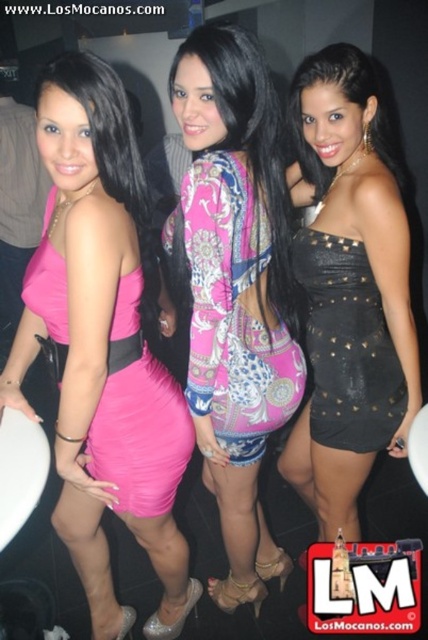
How distant is black studded dress at center from matte pink dress at left?

black studded dress at center and matte pink dress at left are 21.45 inches apart.

Does black studded dress at center appear over matte pink dress at left?

Yes.

This screenshot has width=428, height=640. Identify the location of black studded dress at center. (348, 291).

Image resolution: width=428 pixels, height=640 pixels. What are the coordinates of `black studded dress at center` in the screenshot? It's located at (348, 291).

Is pink satin dress at left taller than matte pink dress at left?

Yes.

Is pink satin dress at left bigger than matte pink dress at left?

Indeed, pink satin dress at left has a larger size compared to matte pink dress at left.

At what (x,y) coordinates should I click in order to perform the action: click on pink satin dress at left. Please return your answer as a coordinate pair (x, y). Looking at the image, I should click on (104, 346).

Can you confirm if pink printed dress at center is bigger than matte pink dress at left?

Indeed, pink printed dress at center has a larger size compared to matte pink dress at left.

Which is below, pink printed dress at center or matte pink dress at left?

matte pink dress at left is lower down.

Identify the location of pink printed dress at center. 234,289.

Find the location of a particular element. Image resolution: width=428 pixels, height=640 pixels. pink printed dress at center is located at coordinates (234, 289).